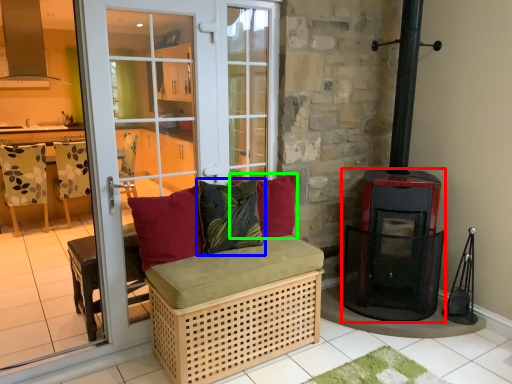
Question: Which object is the closest to the wood burning stove (highlighted by a red box)? Choose among these: pillow (highlighted by a blue box) or pillow (highlighted by a green box).

Choices:
 (A) pillow
 (B) pillow

Answer: (B)